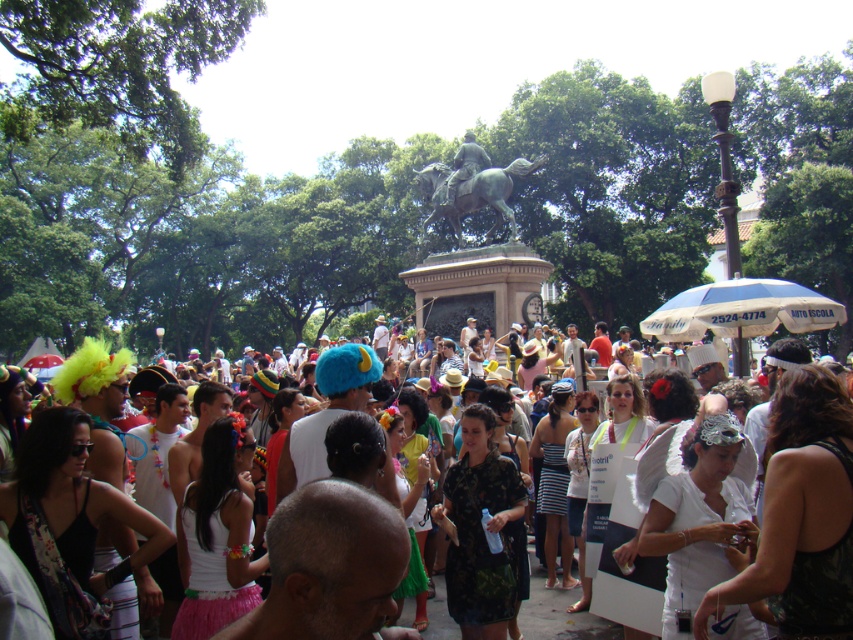
Question: Does bronze statue at center appear over white cotton crowd at center?

Choices:
 (A) yes
 (B) no

Answer: (A)

Question: Which point is farther to the camera?

Choices:
 (A) bronze statue at center
 (B) white cotton crowd at center

Answer: (A)

Question: From the image, what is the correct spatial relationship of bronze statue at center in relation to white cotton crowd at center?

Choices:
 (A) left
 (B) right

Answer: (A)

Question: Which point is closer to the camera?

Choices:
 (A) white cotton crowd at center
 (B) bronze statue at center

Answer: (A)

Question: Can you confirm if bronze statue at center is positioned above white cotton crowd at center?

Choices:
 (A) no
 (B) yes

Answer: (B)